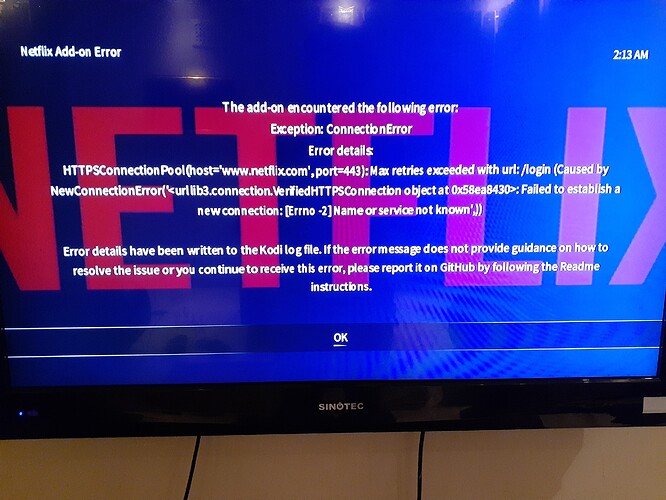
Find the location of a particular element. floor is located at coordinates (375, 469), (468, 475), (164, 473).